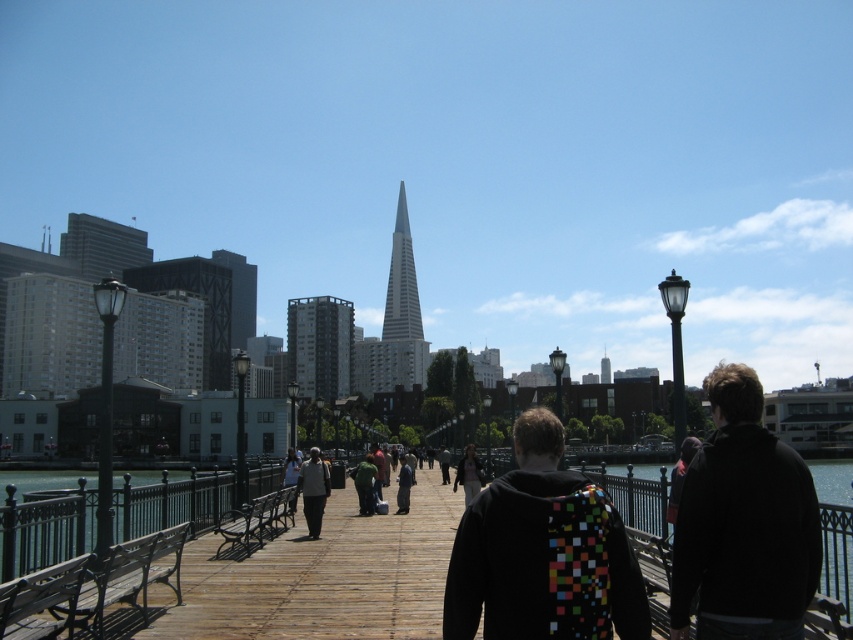
Between silver glass spire at center and green matte jacket at center, which one appears on the left side from the viewer's perspective?

silver glass spire at center

Is silver glass spire at center positioned in front of green matte jacket at center?

That is False.

Who is more forward, [413,305] or [367,502]?

Point [367,502]

Locate an element on the screen. The height and width of the screenshot is (640, 853). silver glass spire at center is located at coordinates (401, 282).

Between point (532, 540) and point (724, 477), which one is positioned in front?

Point (532, 540) is more forward.

Can you confirm if multicolored pixelated backpack at center is positioned to the right of black fabric jacket at right?

No, multicolored pixelated backpack at center is not to the right of black fabric jacket at right.

What do you see at coordinates (543, 552) in the screenshot? The image size is (853, 640). I see `multicolored pixelated backpack at center` at bounding box center [543, 552].

Where is `multicolored pixelated backpack at center`? multicolored pixelated backpack at center is located at coordinates (543, 552).

Describe the element at coordinates (468, 474) in the screenshot. I see `dark green jacket at center` at that location.

Can you confirm if dark green jacket at center is shorter than green matte jacket at center?

In fact, dark green jacket at center may be taller than green matte jacket at center.

Where is `dark green jacket at center`? dark green jacket at center is located at coordinates (468, 474).